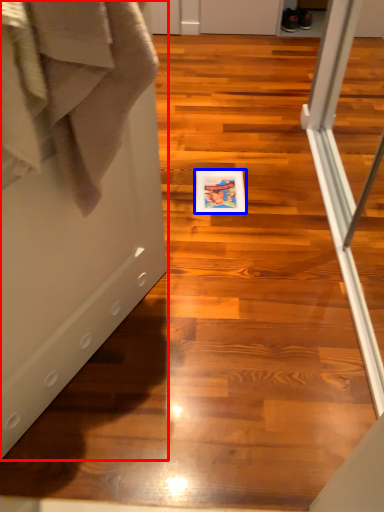
Question: Which object is closer to the camera taking this photo, screen door (highlighted by a red box) or postcard (highlighted by a blue box)?

Choices:
 (A) screen door
 (B) postcard

Answer: (A)